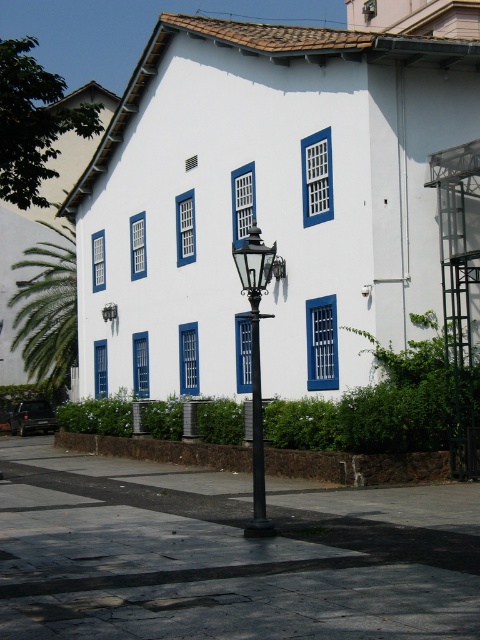
Question: Which point is closer to the camera taking this photo?

Choices:
 (A) (52, 252)
 (B) (255, 486)

Answer: (B)

Question: Does black metal/texture lamp post at center appear under black metal pole at center?

Choices:
 (A) yes
 (B) no

Answer: (A)

Question: Does green leafy palm tree at left have a lesser width compared to black metal/texture lamp post at center?

Choices:
 (A) no
 (B) yes

Answer: (A)

Question: Which object is positioned farthest from the black metal pole at center?

Choices:
 (A) green leafy palm tree at left
 (B) black metal/texture lamp post at center

Answer: (A)

Question: Is green leafy palm tree at left above black metal/texture lamp post at center?

Choices:
 (A) yes
 (B) no

Answer: (A)

Question: Which point appears farthest from the camera in this image?

Choices:
 (A) (264, 252)
 (B) (31, 264)

Answer: (B)